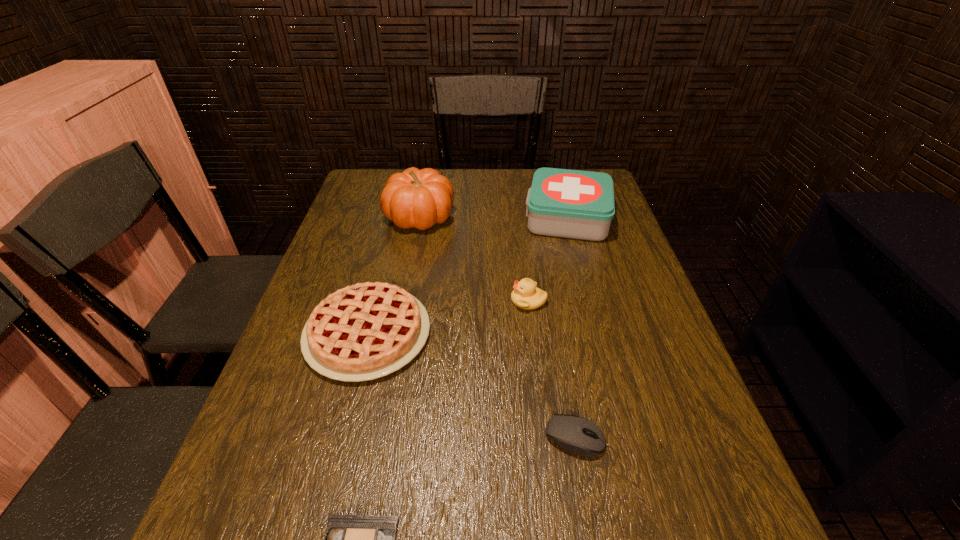
Identify the location of free space at the far edge of the desktop. The image size is (960, 540). (445, 170).

The width and height of the screenshot is (960, 540). In the image, there is a desktop. What are the coordinates of `vacant space at the left edge` in the screenshot? It's located at (339, 247).

Find the location of a particular element. This screenshot has height=540, width=960. vacant space at the right edge is located at coordinates (632, 312).

At what (x,y) coordinates should I click in order to perform the action: click on free space at the far left corner. Please return your answer as a coordinate pair (x, y). Looking at the image, I should click on pyautogui.click(x=369, y=193).

At what (x,y) coordinates should I click in order to perform the action: click on free space between the first-aid kit and the duckling. Please return your answer as a coordinate pair (x, y). Looking at the image, I should click on (548, 259).

The height and width of the screenshot is (540, 960). Find the location of `free spot between the duckling and the first-aid kit`. free spot between the duckling and the first-aid kit is located at coordinates (548, 259).

This screenshot has width=960, height=540. I want to click on free space between the fourth shortest object and the fourth tallest object, so tap(448, 317).

Identify the location of free area in between the fourth tallest object and the tallest object. (394, 275).

Where is `vacant area that lies between the second shortest object and the first-aid kit`? This screenshot has width=960, height=540. vacant area that lies between the second shortest object and the first-aid kit is located at coordinates (571, 328).

Where is `free space between the second nearest object and the third tallest object`? This screenshot has height=540, width=960. free space between the second nearest object and the third tallest object is located at coordinates pos(552,369).